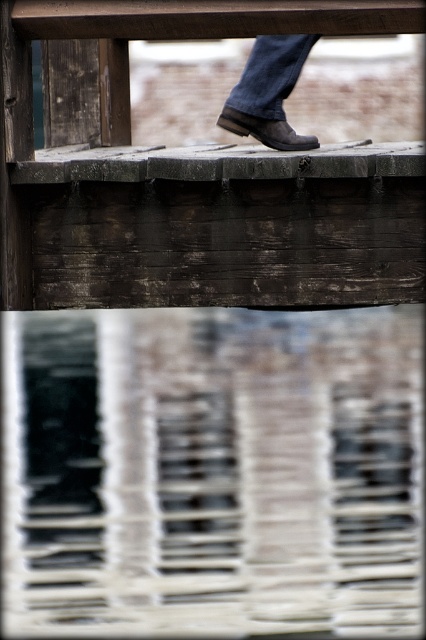
Between translucent glass water at center and brown leather boot at center, which one appears on the right side from the viewer's perspective?

brown leather boot at center is more to the right.

Between translucent glass water at center and brown leather boot at center, which one has less height?

With less height is brown leather boot at center.

You are a GUI agent. You are given a task and a screenshot of the screen. Output one action in this format:
    pyautogui.click(x=<x>, y=<y>)
    Task: Click on the translucent glass water at center
    The image size is (426, 640).
    Given the screenshot: What is the action you would take?
    pyautogui.click(x=213, y=472)

Does translucent glass water at center appear on the left side of denim at center?

Indeed, translucent glass water at center is positioned on the left side of denim at center.

Describe the element at coordinates (213, 472) in the screenshot. This screenshot has height=640, width=426. I see `translucent glass water at center` at that location.

This screenshot has height=640, width=426. Identify the location of translucent glass water at center. (213, 472).

Between denim at center and brown leather boot at center, which one appears on the right side from the viewer's perspective?

From the viewer's perspective, denim at center appears more on the right side.

Is denim at center above brown leather boot at center?

Yes.

The image size is (426, 640). Describe the element at coordinates (270, 76) in the screenshot. I see `denim at center` at that location.

Locate an element on the screen. The image size is (426, 640). denim at center is located at coordinates (270, 76).